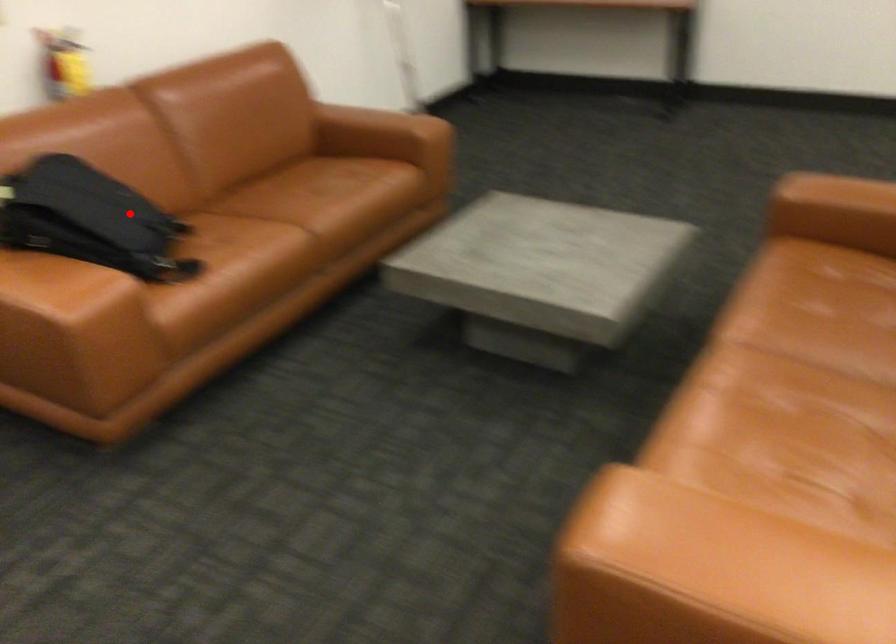
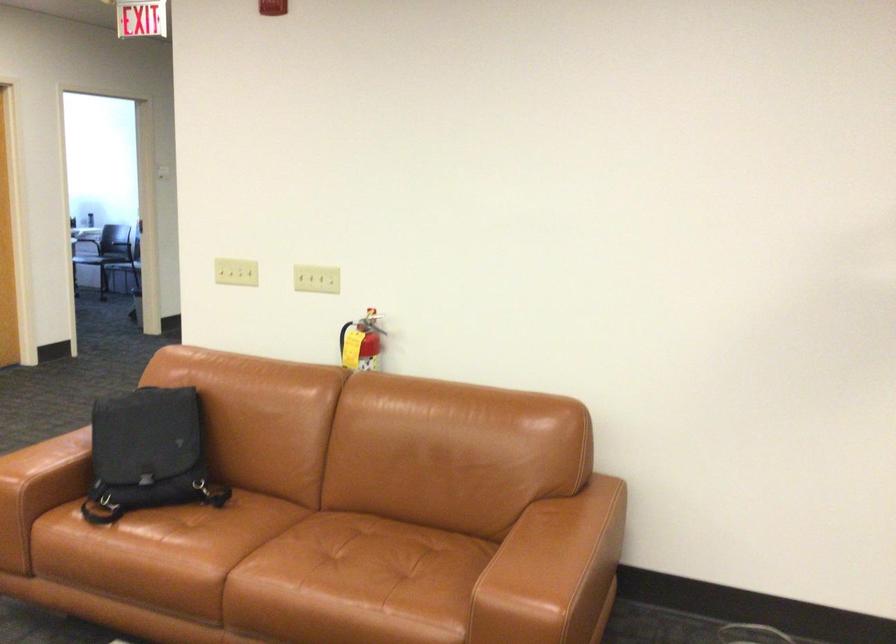
Question: I am providing you with two images of the same scene from different viewpoints. Given a red point in image1, look at the same physical point in image2. Is it:

Choices:
 (A) Closer to the viewpoint
 (B) Farther from the viewpoint

Answer: (B)